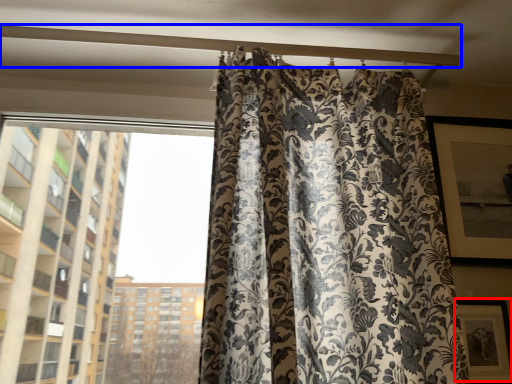
Question: Which point is closer to the camera, picture frame (highlighted by a red box) or beam (highlighted by a blue box)?

Choices:
 (A) picture frame
 (B) beam

Answer: (A)